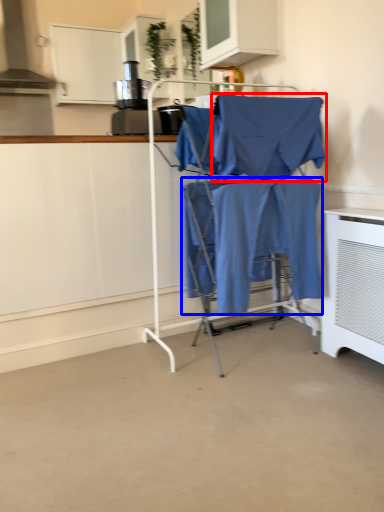
Question: Which point is further to the camera, fabric (highlighted by a red box) or fabric (highlighted by a blue box)?

Choices:
 (A) fabric
 (B) fabric

Answer: (B)